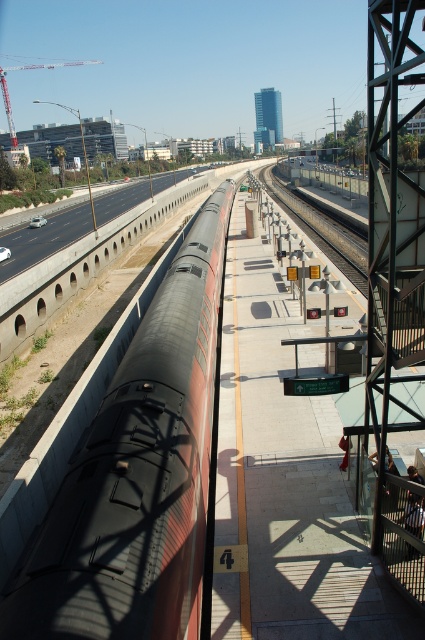
Question: Does black asphalt highway at left appear on the right side of black metal train track at center?

Choices:
 (A) no
 (B) yes

Answer: (A)

Question: Which object is the farthest from the black metal train track at center?

Choices:
 (A) matte black train at center
 (B) black asphalt highway at left

Answer: (B)

Question: Does black asphalt highway at left appear over black metal train track at center?

Choices:
 (A) yes
 (B) no

Answer: (A)

Question: Which of the following is the farthest from the observer?

Choices:
 (A) matte black train at center
 (B) black asphalt highway at left
 (C) black metal train track at center

Answer: (B)

Question: Where is black asphalt highway at left located in relation to black metal train track at center in the image?

Choices:
 (A) above
 (B) below

Answer: (A)

Question: Estimate the real-world distances between objects in this image. Which object is closer to the matte black train at center?

Choices:
 (A) black asphalt highway at left
 (B) black metal train track at center

Answer: (B)